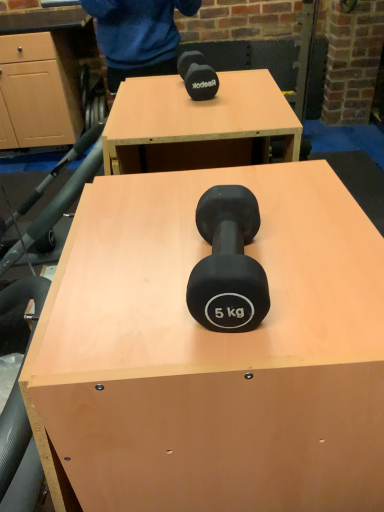
This screenshot has width=384, height=512. What do you see at coordinates (212, 353) in the screenshot? I see `matte black dumbbell at center` at bounding box center [212, 353].

I want to click on matte black dumbbell at center, so click(212, 353).

Describe the element at coordinates (228, 263) in the screenshot. Image resolution: width=384 pixels, height=512 pixels. I see `black rubber dumbbell at center` at that location.

Locate an element on the screen. The image size is (384, 512). black rubber dumbbell at center is located at coordinates (228, 263).

Measure the distance between black rubber dumbbell at center and camera.

A distance of 45.50 centimeters exists between black rubber dumbbell at center and camera.

What are the coordinates of `matte black dumbbell at center` in the screenshot? It's located at (212, 353).

Would you say black rubber dumbbell at center is to the left or to the right of matte black dumbbell at center in the picture?

Based on their positions, black rubber dumbbell at center is located to the right of matte black dumbbell at center.

Which object is further away from the camera taking this photo, black rubber dumbbell at center or matte black dumbbell at center?

matte black dumbbell at center.

Which is in front, point (224, 196) or point (174, 278)?

The point (174, 278) is in front.

From the image's perspective, is black rubber dumbbell at center located above or below matte black dumbbell at center?

From the image's perspective, black rubber dumbbell at center appears above matte black dumbbell at center.

From a real-world perspective, which is physically below, black rubber dumbbell at center or matte black dumbbell at center?

matte black dumbbell at center.

Between black rubber dumbbell at center and matte black dumbbell at center, which one has smaller width?

black rubber dumbbell at center is thinner.

Does black rubber dumbbell at center have a lesser height compared to matte black dumbbell at center?

Indeed, black rubber dumbbell at center has a lesser height compared to matte black dumbbell at center.

Considering the relative sizes of black rubber dumbbell at center and matte black dumbbell at center in the image provided, is black rubber dumbbell at center smaller than matte black dumbbell at center?

Indeed, black rubber dumbbell at center has a smaller size compared to matte black dumbbell at center.

Looking at this image, is matte black dumbbell at center surrounded by black rubber dumbbell at center?

No, matte black dumbbell at center is located outside of black rubber dumbbell at center.

Is there a large distance between black rubber dumbbell at center and matte black dumbbell at center?

No.

Is black rubber dumbbell at center looking in the opposite direction of matte black dumbbell at center?

black rubber dumbbell at center is not turned away from matte black dumbbell at center.

Can you tell me how much black rubber dumbbell at center and matte black dumbbell at center differ in facing direction?

There is a 1.64-degree angle between the facing directions of black rubber dumbbell at center and matte black dumbbell at center.

Measure the distance from black rubber dumbbell at center to matte black dumbbell at center.

They are 6.38 inches apart.

In the image, there is a black rubber dumbbell at center. Where is `table below it (from the image's perspective)`? Image resolution: width=384 pixels, height=512 pixels. table below it (from the image's perspective) is located at coordinates (212, 353).

From the picture: Which object is positioned more to the right, matte black dumbbell at center or black rubber dumbbell at center?

black rubber dumbbell at center.

Considering the positions of objects matte black dumbbell at center and black rubber dumbbell at center in the image provided, who is behind, matte black dumbbell at center or black rubber dumbbell at center?

matte black dumbbell at center is more distant.

Considering the positions of point (285, 490) and point (195, 319), is point (285, 490) closer or farther from the camera than point (195, 319)?

Point (285, 490) is positioned farther from the camera compared to point (195, 319).

From the image's perspective, between matte black dumbbell at center and black rubber dumbbell at center, who is located below?

matte black dumbbell at center, from the image's perspective.

From a real-world perspective, is matte black dumbbell at center physically located above or below black rubber dumbbell at center?

Clearly, from a real-world perspective, matte black dumbbell at center is below black rubber dumbbell at center.

Between matte black dumbbell at center and black rubber dumbbell at center, which one has larger width?

With larger width is matte black dumbbell at center.

Considering the sizes of objects matte black dumbbell at center and black rubber dumbbell at center in the image provided, who is shorter, matte black dumbbell at center or black rubber dumbbell at center?

black rubber dumbbell at center is shorter.

Is matte black dumbbell at center smaller than black rubber dumbbell at center?

Incorrect, matte black dumbbell at center is not smaller in size than black rubber dumbbell at center.

Is matte black dumbbell at center situated inside black rubber dumbbell at center or outside?

matte black dumbbell at center is spatially situated outside black rubber dumbbell at center.

Can you see matte black dumbbell at center touching black rubber dumbbell at center?

They are not placed beside each other.

Could you tell me if matte black dumbbell at center is turned towards black rubber dumbbell at center?

No, matte black dumbbell at center does not turn towards black rubber dumbbell at center.

How different are the orientations of matte black dumbbell at center and black rubber dumbbell at center in degrees?

There is a 1.64-degree angle between the facing directions of matte black dumbbell at center and black rubber dumbbell at center.

The image size is (384, 512). I want to click on dumbbell that is above the matte black dumbbell at center (from a real-world perspective), so click(x=228, y=263).

This screenshot has width=384, height=512. What are the coordinates of `table located underneath the black rubber dumbbell at center (from a real-world perspective)` in the screenshot? It's located at (212, 353).

Where is `table behind the black rubber dumbbell at center`? Image resolution: width=384 pixels, height=512 pixels. table behind the black rubber dumbbell at center is located at coordinates (212, 353).